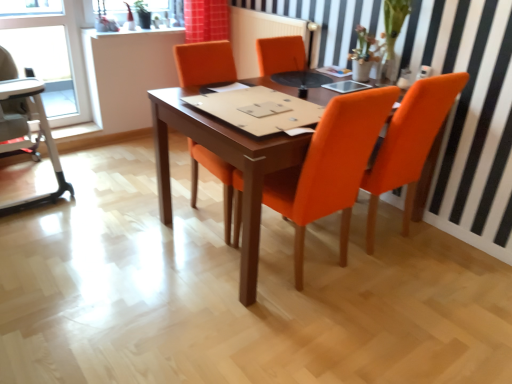
Question: Does beige fabric high chair at left contain wooden table at center?

Choices:
 (A) yes
 (B) no

Answer: (B)

Question: Does beige fabric high chair at left lie behind wooden table at center?

Choices:
 (A) no
 (B) yes

Answer: (B)

Question: Is beige fabric high chair at left completely or partially outside of wooden table at center?

Choices:
 (A) yes
 (B) no

Answer: (A)

Question: Considering the relative sizes of beige fabric high chair at left and wooden table at center in the image provided, is beige fabric high chair at left thinner than wooden table at center?

Choices:
 (A) no
 (B) yes

Answer: (B)

Question: Is beige fabric high chair at left not close to wooden table at center?

Choices:
 (A) yes
 (B) no

Answer: (A)

Question: Is wooden table at center bigger or smaller than orange fabric chair at center, positioned as the first chair in left-to-right order?

Choices:
 (A) small
 (B) big

Answer: (B)

Question: Does point (202, 137) appear closer or farther from the camera than point (190, 71)?

Choices:
 (A) closer
 (B) farther

Answer: (A)

Question: Is wooden table at center taller or shorter than orange fabric chair at center, the second chair from the right?

Choices:
 (A) tall
 (B) short

Answer: (B)

Question: Visually, is wooden table at center positioned to the left or to the right of orange fabric chair at center, positioned as the first chair in left-to-right order?

Choices:
 (A) right
 (B) left

Answer: (A)

Question: Considering the positions of wooden table at center and orange fabric chair at right, the 1th chair from the right, in the image, is wooden table at center wider or thinner than orange fabric chair at right, the 1th chair from the right,?

Choices:
 (A) thin
 (B) wide

Answer: (B)

Question: From a real-world perspective, relative to orange fabric chair at right, which is the 2th chair in left-to-right order, is wooden table at center vertically above or below?

Choices:
 (A) below
 (B) above

Answer: (A)

Question: Is wooden table at center to the left or to the right of orange fabric chair at right, the 1th chair from the right, in the image?

Choices:
 (A) right
 (B) left

Answer: (B)

Question: In terms of height, does wooden table at center look taller or shorter compared to orange fabric chair at right, which is the 2th chair in left-to-right order?

Choices:
 (A) tall
 (B) short

Answer: (B)

Question: Is orange fabric chair at center, positioned as the first chair in left-to-right order, taller or shorter than transparent glass window at upper left?

Choices:
 (A) short
 (B) tall

Answer: (B)

Question: From a real-world perspective, is orange fabric chair at center, the second chair from the right, above or below transparent glass window at upper left?

Choices:
 (A) below
 (B) above

Answer: (A)